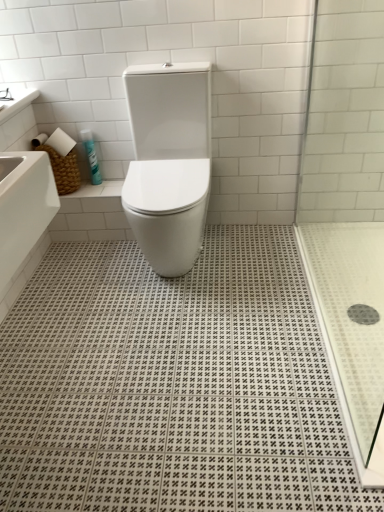
What are the coordinates of `free space in front of blue glossy spray can at upper left` in the screenshot? It's located at [100, 189].